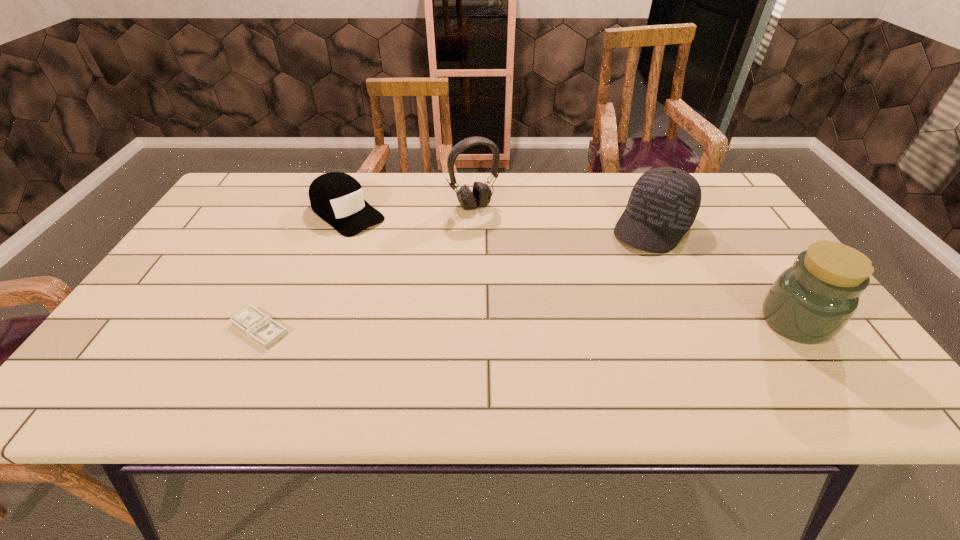
The height and width of the screenshot is (540, 960). In order to click on the fourth closest object to the jar in this screenshot , I will do `click(261, 328)`.

You are a GUI agent. You are given a task and a screenshot of the screen. Output one action in this format:
    pyautogui.click(x=<x>, y=<y>)
    Task: Click on the vacant area in the image that satisfies the following two spatial constraints: 1. on the front side of the cap; 2. on the left side of the rightmost object
    Image resolution: width=960 pixels, height=540 pixels.
    Given the screenshot: What is the action you would take?
    pyautogui.click(x=306, y=322)

Identify the location of vacant area in the image that satisfies the following two spatial constraints: 1. on the back side of the money; 2. on the left side of the cap. (315, 213).